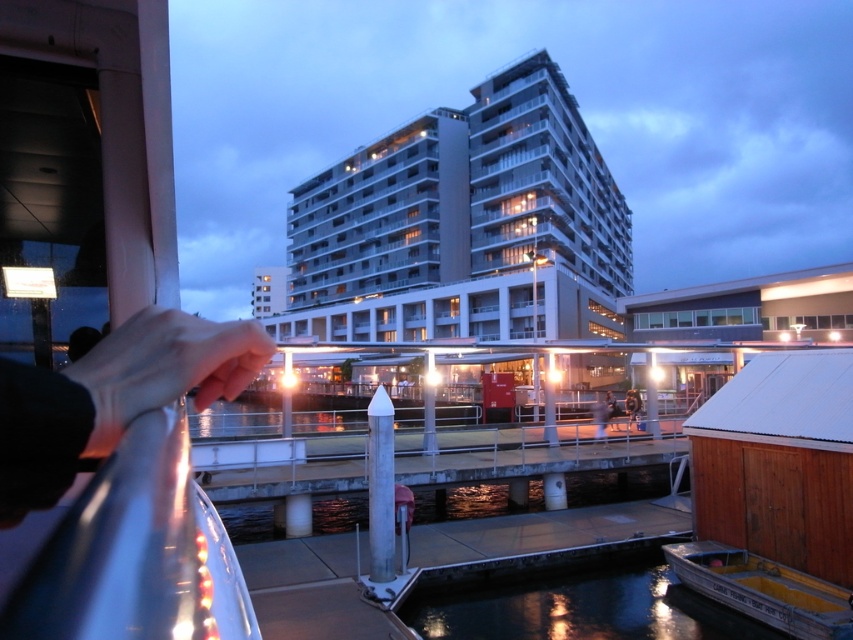
Question: Can you confirm if white concrete building at center is wider than metallic yellow boat at lower right?

Choices:
 (A) no
 (B) yes

Answer: (B)

Question: Does white concrete building at center lie in front of dark reflective water at lower center?

Choices:
 (A) no
 (B) yes

Answer: (A)

Question: Which is farther from the black leather hand at lower left?

Choices:
 (A) dark reflective water at lower center
 (B) smooth skin person at center

Answer: (B)

Question: Which point appears closest to the camera in this image?

Choices:
 (A) (521, 602)
 (B) (740, 556)
 (C) (244, 342)
 (D) (503, 170)

Answer: (C)

Question: Which point is farther from the camera taking this photo?

Choices:
 (A) (741, 560)
 (B) (676, 600)
 (C) (173, 323)
 (D) (602, 429)

Answer: (D)

Question: Is the position of white concrete building at center more distant than that of black leather hand at lower left?

Choices:
 (A) no
 (B) yes

Answer: (B)